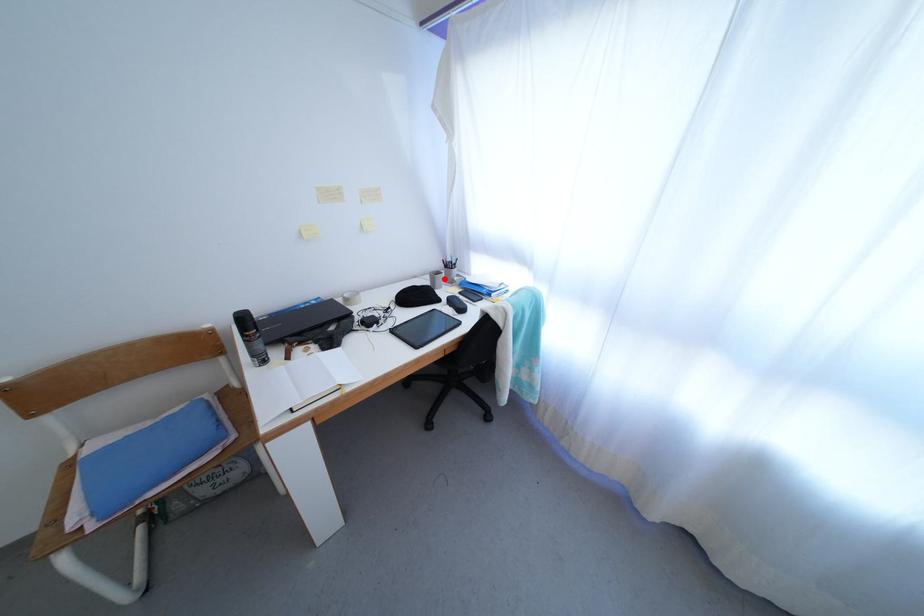
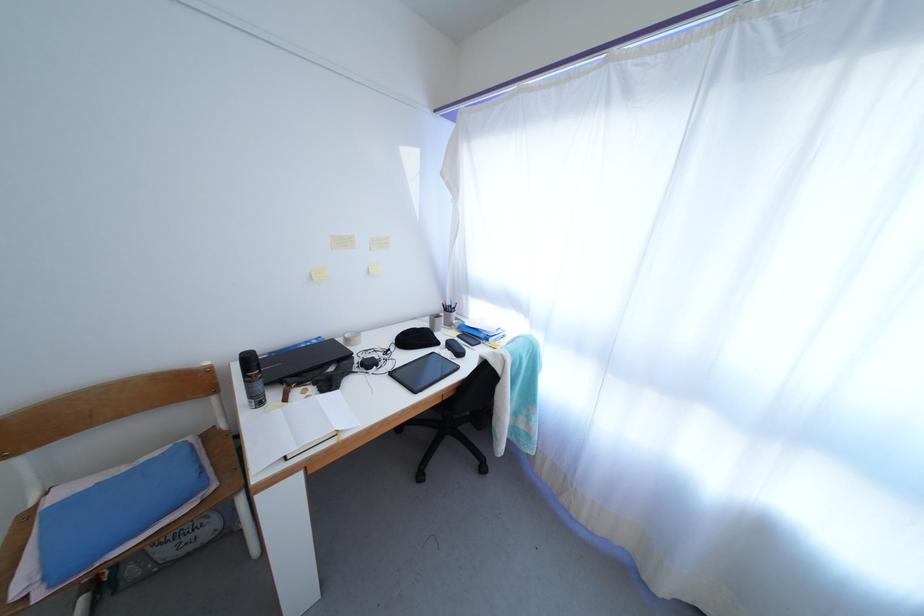
Locate, in the second image, the point that corresponds to the highlighted location in the first image.

(444, 322)